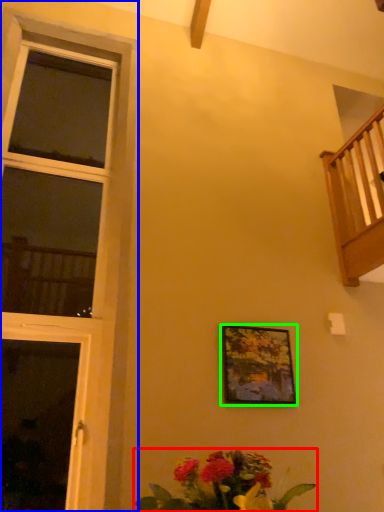
Question: Which is farther away from floral arrangement (highlighted by a red box)? window (highlighted by a blue box) or picture frame (highlighted by a green box)?

Choices:
 (A) window
 (B) picture frame

Answer: (A)